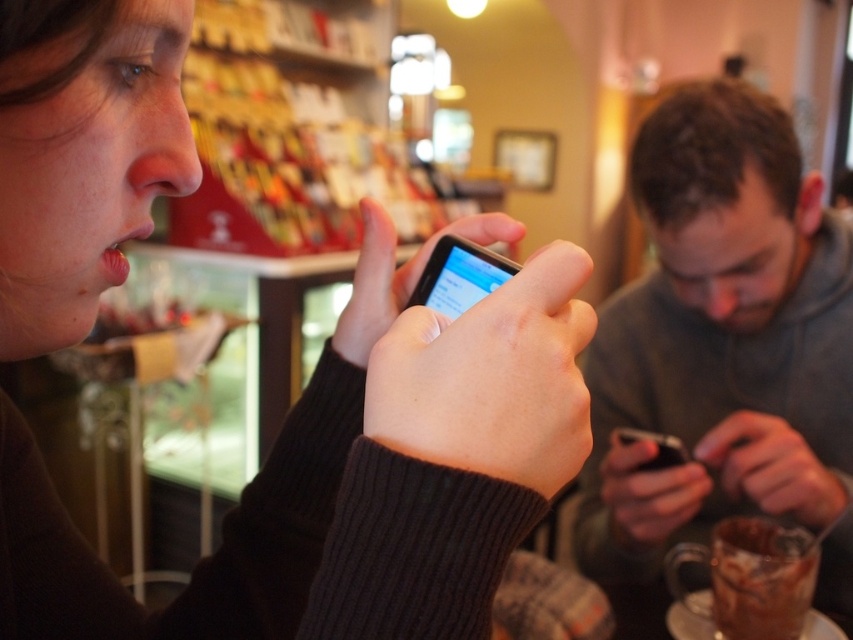
You are standing in a cozy indoor space and want to take a photo of the point at coordinate point (117, 49). The camera you are using has a focal length of 50mm. If the point is 30.14 centimeters away from the camera, what is the approximate distance in millimeters from the center of the camera sensor to the point on the sensor where the image of the coordinate point will be formed?

The distance can be calculated using the formula distance_on_sensor_mm 30.14 cm is 301.4 mm. The formula is sensor_distance_mm 50mm focal length. So, sensor_distance_mm 50mm focal length. So, the distance on the sensor is approximately 50mm multiplied by the ratio of the object distance to the focal length. Wait, actually, the formula for the image distance in a camera lens is given by 1 1 1. However, for small objects and when the object is far away compared to the focal length, the image distance is close

You are designing a display case for a new phone model. The case must accommodate both the matte black phone at center and the gray hoodie at center. Given their sizes, which object should be placed on top to ensure stability?

The gray hoodie at center should be placed on top of the matte black phone at center because the matte black phone at center is shorter than the gray hoodie at center, making the hoodie more stable when placed above.